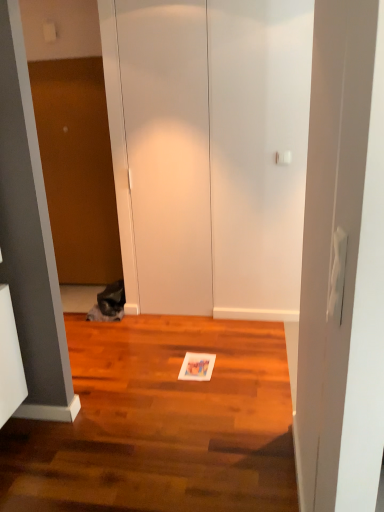
I want to click on free space in front of fuzzy gray cat at left, so click(110, 328).